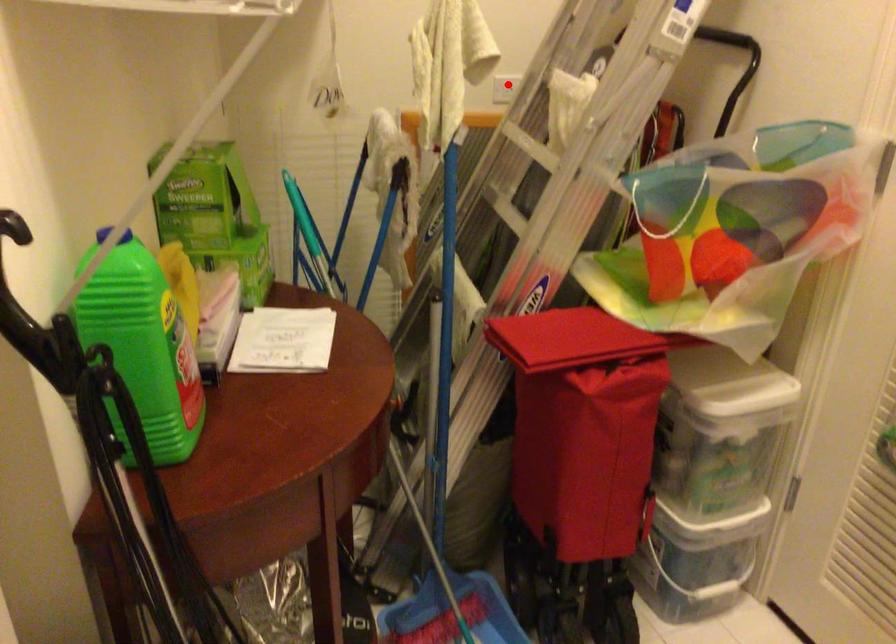
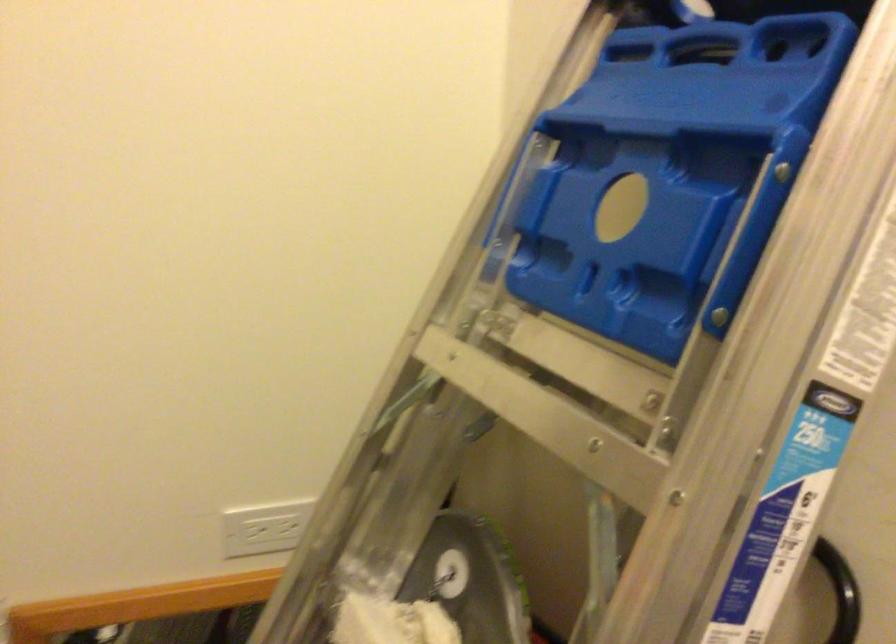
The point at the highlighted location is marked in the first image. Where is the corresponding point in the second image?

(263, 527)